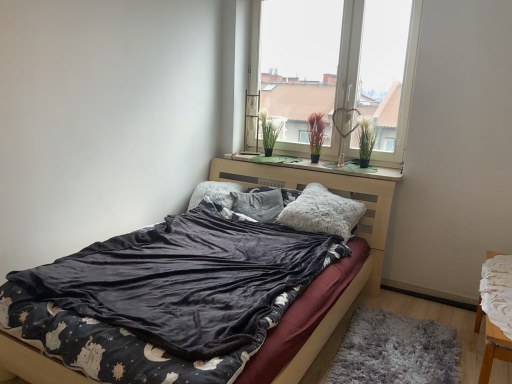
You are a GUI agent. You are given a task and a screenshot of the screen. Output one action in this format:
    pyautogui.click(x=<x>, y=<y>)
    Task: Click on the free spot below gray shaggy rug at lower right (from a real-world perspective)
    The height and width of the screenshot is (384, 512).
    Given the screenshot: What is the action you would take?
    pyautogui.click(x=392, y=346)